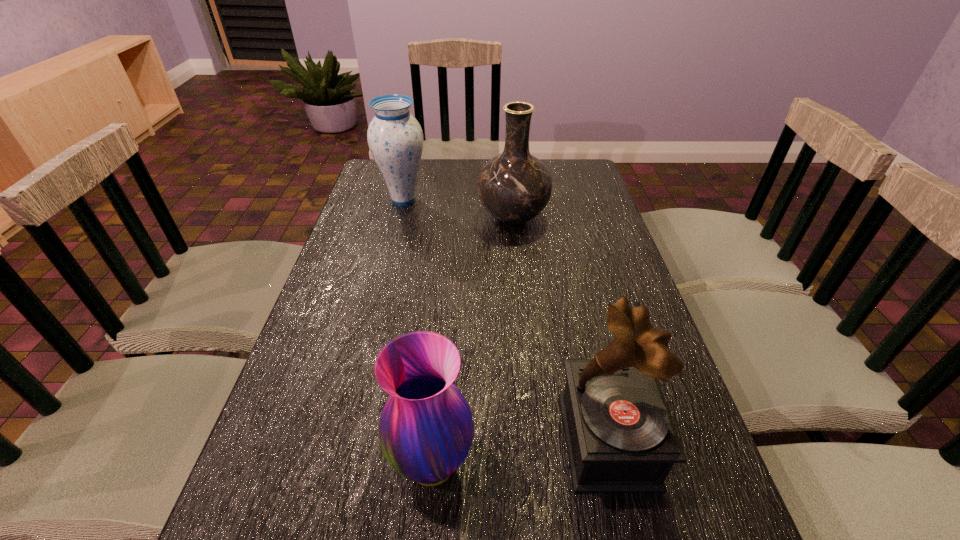
Identify the location of free space between the nearest vase and the rightmost vase. (472, 341).

At what (x,y) coordinates should I click in order to perform the action: click on free space between the phonograph_record and the second object from left to right. Please return your answer as a coordinate pair (x, y). The width and height of the screenshot is (960, 540). Looking at the image, I should click on (519, 453).

Find the location of a particular element. Image resolution: width=960 pixels, height=540 pixels. empty space between the rightmost vase and the nearest vase is located at coordinates (472, 341).

Where is `blank region between the leftmost vase and the rightmost vase`? blank region between the leftmost vase and the rightmost vase is located at coordinates (458, 208).

Image resolution: width=960 pixels, height=540 pixels. I want to click on free space between the rightmost vase and the leftmost vase, so click(458, 208).

Where is `free space that is in between the second vase from left to right and the phonograph_record`? free space that is in between the second vase from left to right and the phonograph_record is located at coordinates (519, 453).

You are a GUI agent. You are given a task and a screenshot of the screen. Output one action in this format:
    pyautogui.click(x=<x>, y=<y>)
    Task: Click on the free space between the rightmost vase and the phonograph_record
    Image resolution: width=960 pixels, height=540 pixels.
    Given the screenshot: What is the action you would take?
    pyautogui.click(x=560, y=329)

Locate which object ranks third in proximity to the rightmost vase. Please provide its 2D coordinates. Your answer should be formatted as a tuple, i.e. [(x, y)], where the tuple contains the x and y coordinates of a point satisfying the conditions above.

[(426, 429)]

At what (x,y) coordinates should I click in order to perform the action: click on object that is the second nearest to the second object from left to right. Please return your answer as a coordinate pair (x, y). The width and height of the screenshot is (960, 540). Looking at the image, I should click on (514, 187).

Locate an element on the screen. vase object that ranks as the third closest to the phonograph_record is located at coordinates (395, 138).